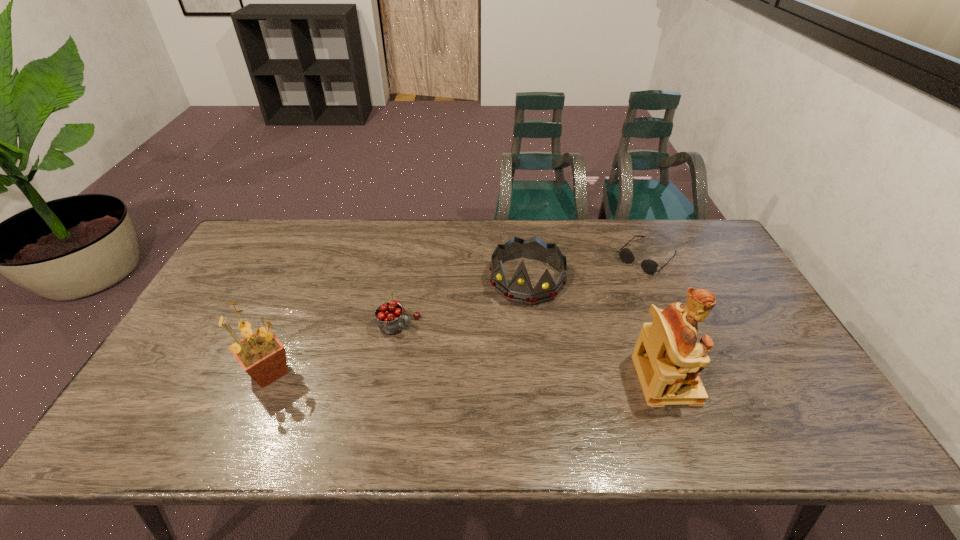
I want to click on sunflower at the near edge, so click(263, 357).

The width and height of the screenshot is (960, 540). I want to click on figurine at the near edge, so click(668, 359).

Find the location of `object at the right edge`. object at the right edge is located at coordinates (649, 266).

Locate an element on the screen. object located at the far right corner is located at coordinates (649, 266).

The height and width of the screenshot is (540, 960). In the image, there is a desktop. Find the location of `free space at the far edge`. free space at the far edge is located at coordinates (352, 240).

Locate an element on the screen. vacant area at the near edge of the desktop is located at coordinates (594, 381).

Find the location of a particular element. vacant space at the left edge of the desktop is located at coordinates (204, 326).

Locate an element on the screen. This screenshot has width=960, height=540. vacant space at the right edge of the desktop is located at coordinates (733, 300).

Where is `free space at the far left corner`? This screenshot has height=540, width=960. free space at the far left corner is located at coordinates pyautogui.click(x=251, y=258).

You are a GUI agent. You are given a task and a screenshot of the screen. Output one action in this format:
    pyautogui.click(x=<x>, y=<y>)
    Task: Click on the free space between the tallest object and the third shortest object
    The image size is (960, 540).
    Given the screenshot: What is the action you would take?
    pyautogui.click(x=596, y=329)